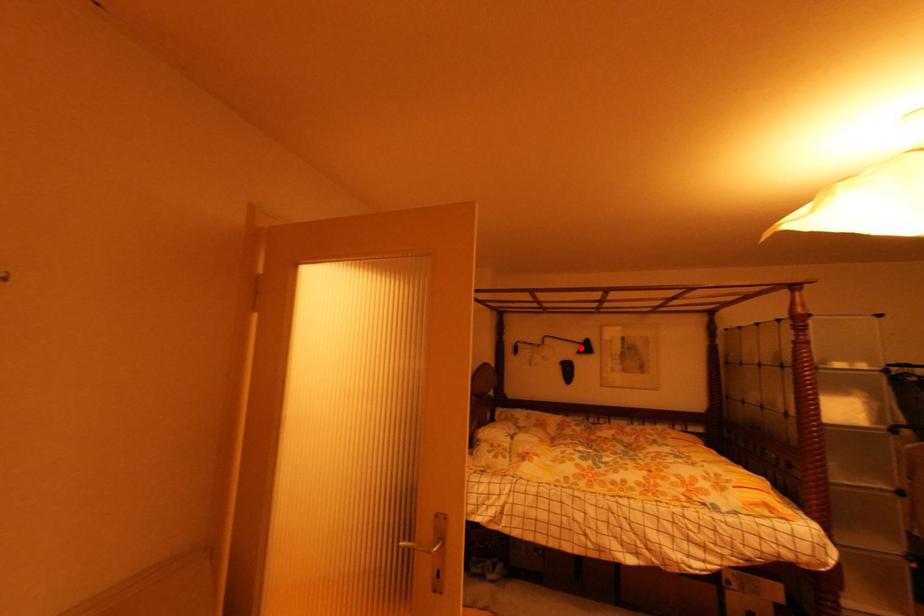
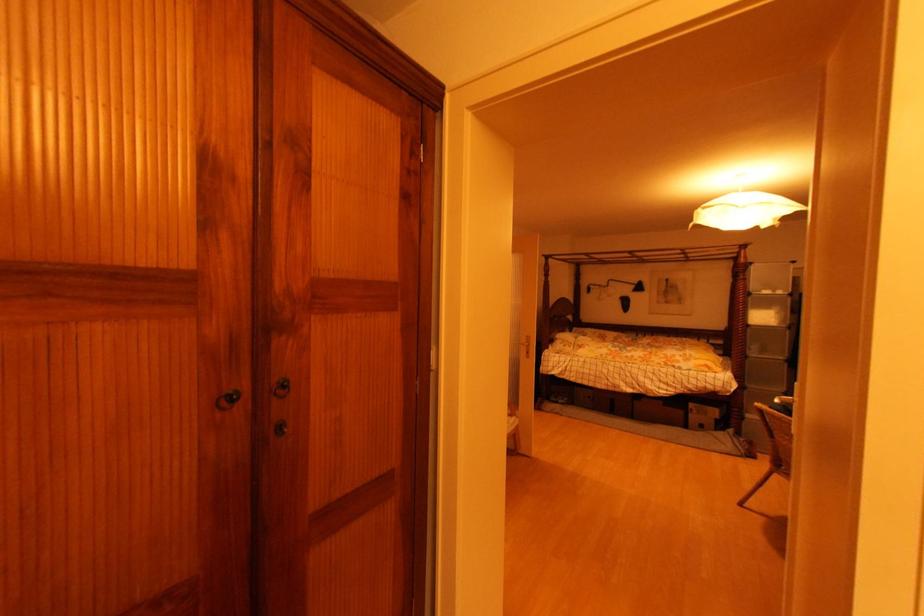
The point at the highlighted location is marked in the first image. Where is the corresponding point in the second image?

(638, 288)